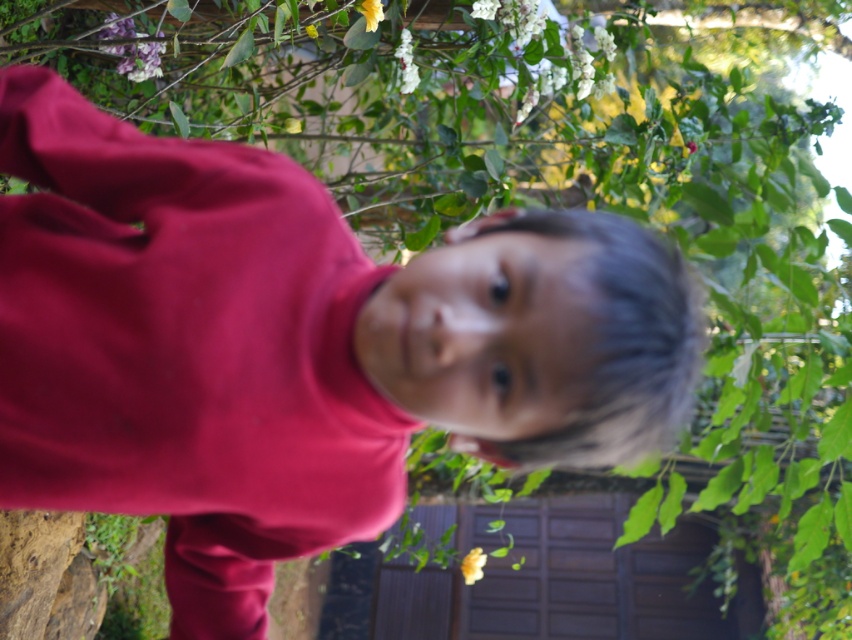
Question: Among these objects, which one is nearest to the camera?

Choices:
 (A) white matte flower at upper center
 (B) yellow matte flower at upper center
 (C) yellow matte flower at lower center
 (D) matte purple flower at upper left

Answer: (B)

Question: Is matte purple flower at upper left bigger than yellow matte flower at upper center?

Choices:
 (A) yes
 (B) no

Answer: (A)

Question: Which point is farther to the camera?

Choices:
 (A) (473, 570)
 (B) (380, 10)
 (C) (404, 44)

Answer: (A)

Question: Is white matte flower at upper center thinner than yellow matte flower at upper center?

Choices:
 (A) no
 (B) yes

Answer: (A)

Question: Which of the following is the farthest from the observer?

Choices:
 (A) (121, 45)
 (B) (401, 86)

Answer: (B)

Question: Is matte purple flower at upper left below white matte flower at upper center?

Choices:
 (A) yes
 (B) no

Answer: (B)